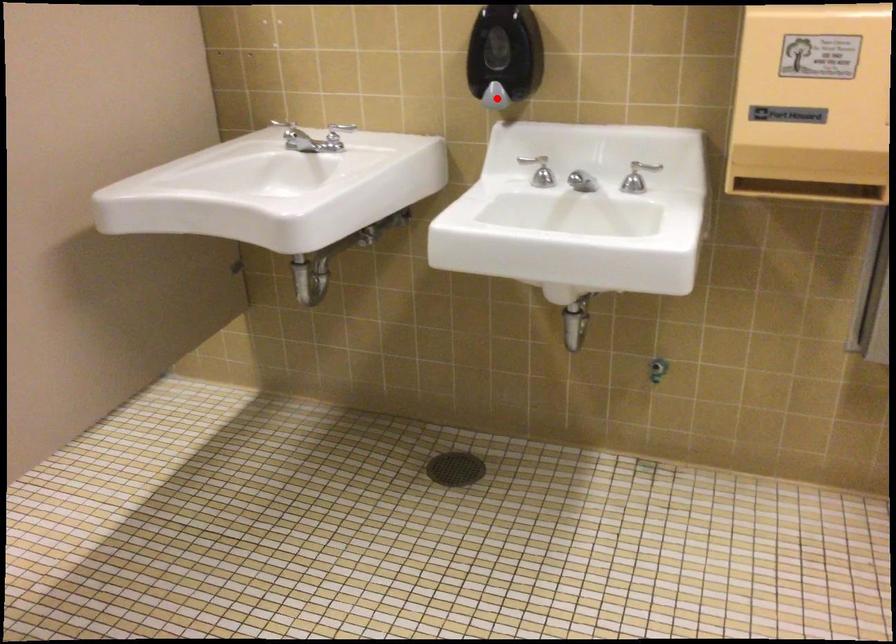
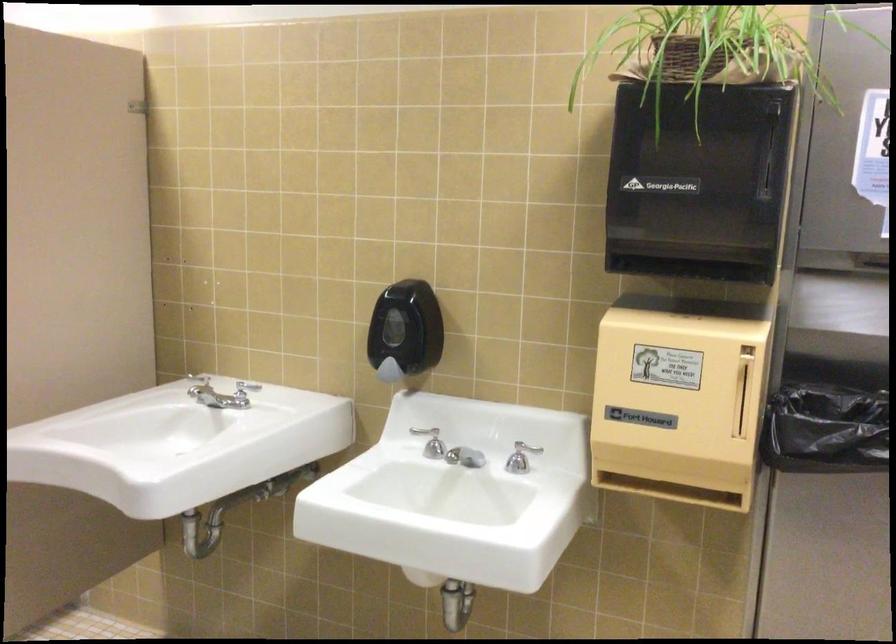
In the second image, find the point that corresponds to the highlighted location in the first image.

(389, 371)